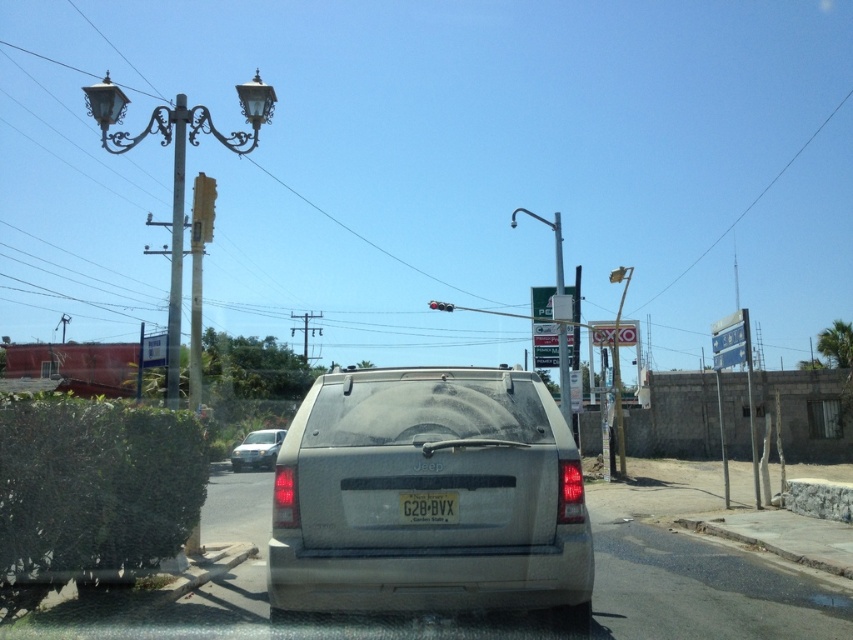
Question: Which point appears farthest from the camera in this image?

Choices:
 (A) (375, 408)
 (B) (561, 275)
 (C) (202, 234)
 (D) (175, 192)

Answer: (B)

Question: Does metallic pole at left lie in front of metallic traffic light at upper center?

Choices:
 (A) yes
 (B) no

Answer: (A)

Question: Is gray matte minivan at center thinner than metallic pole at left?

Choices:
 (A) no
 (B) yes

Answer: (B)

Question: Which of the following is the closest to the observer?

Choices:
 (A) green plastic sign at upper center
 (B) white plastic license plate at center
 (C) silver metallic sedan at left
 (D) metallic pole at center

Answer: (B)

Question: Considering the real-world distances, which object is closest to the metallic traffic light at upper center?

Choices:
 (A) green plastic sign at upper center
 (B) white plastic license plate at center
 (C) metallic pole at center
 (D) polished brass streetlight at upper left

Answer: (B)

Question: Is green plastic sign at upper center smaller than white plastic license plate at center?

Choices:
 (A) no
 (B) yes

Answer: (A)